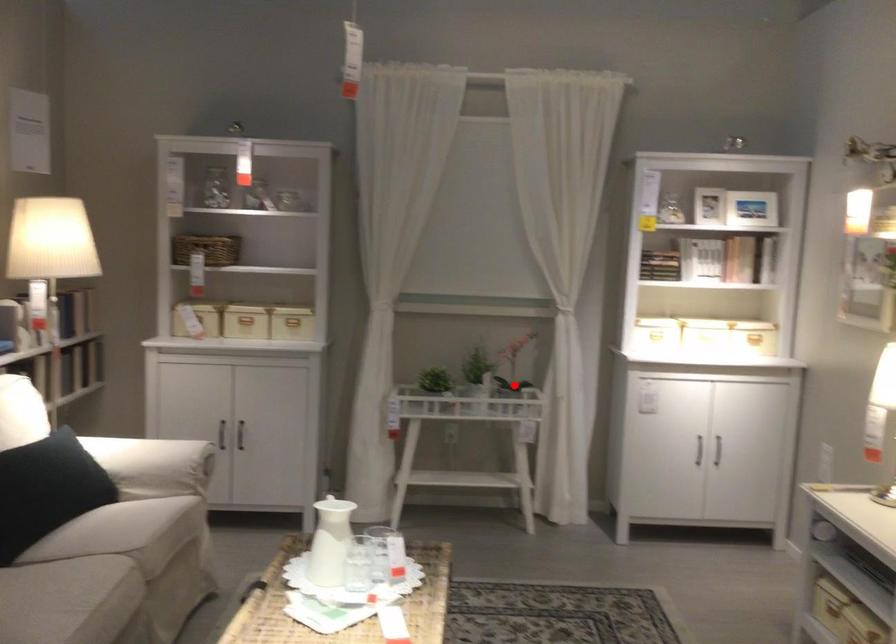
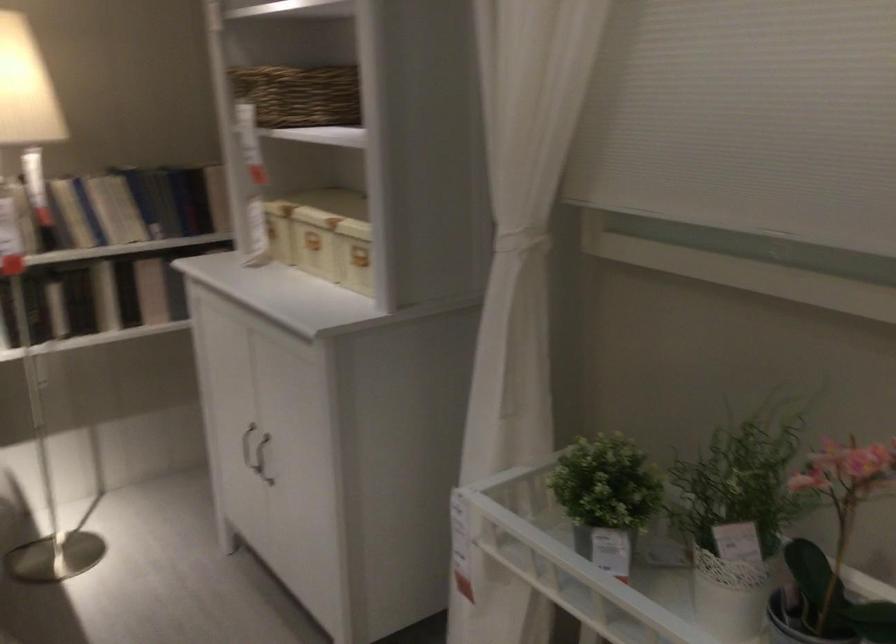
Locate, in the second image, the point that corresponds to the highlighted location in the first image.

(839, 542)